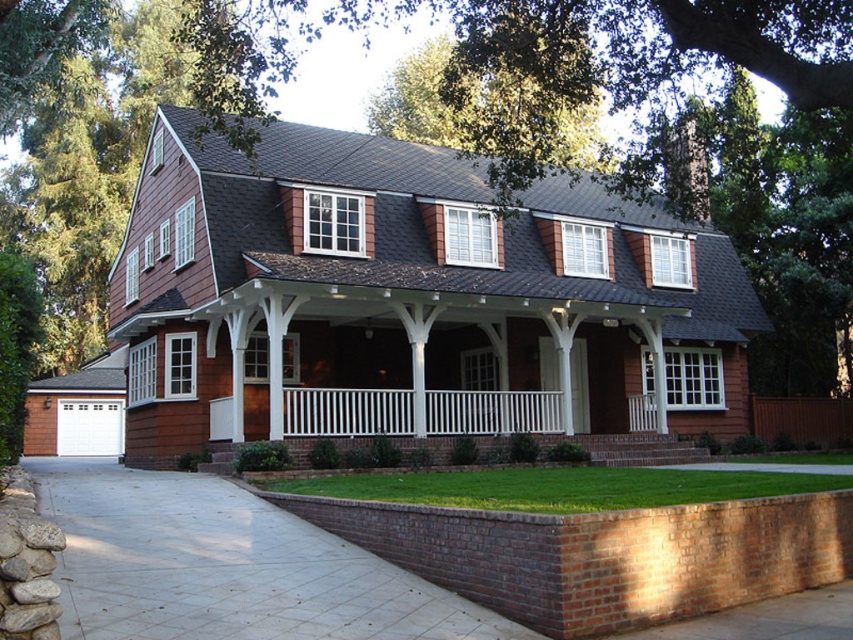
Is gray concrete driveway at lower left closer to camera compared to white painted wood porch at center?

Yes, it is.

Is point (109, 627) in front of point (376, 422)?

Yes, point (109, 627) is closer to viewer.

Locate an element on the screen. The height and width of the screenshot is (640, 853). gray concrete driveway at lower left is located at coordinates (225, 566).